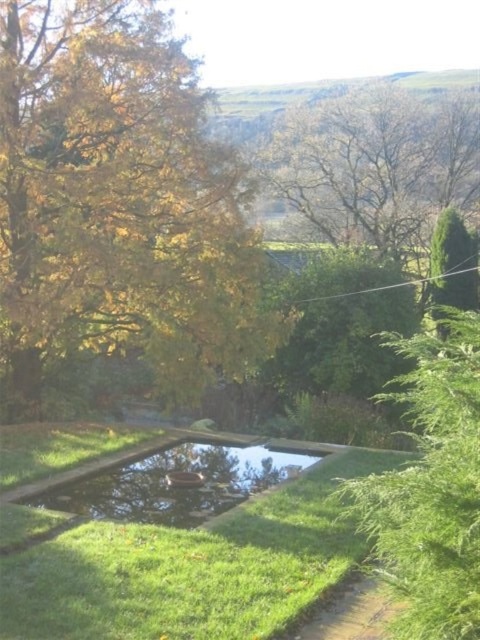
Does green grass at center have a greater width compared to clear glass pond at center?

Yes.

Is green grass at center below clear glass pond at center?

Indeed, green grass at center is positioned under clear glass pond at center.

The width and height of the screenshot is (480, 640). Describe the element at coordinates (192, 566) in the screenshot. I see `green grass at center` at that location.

You are a GUI agent. You are given a task and a screenshot of the screen. Output one action in this format:
    pyautogui.click(x=<x>, y=<y>)
    Task: Click on the green grass at center
    
    Given the screenshot: What is the action you would take?
    pyautogui.click(x=192, y=566)

In the scene shown: Does green leafy tree at right come behind green textured tree at right?

No.

Is point (479, 620) closer to viewer compared to point (472, 291)?

Yes, it is in front of point (472, 291).

The width and height of the screenshot is (480, 640). I want to click on green leafy tree at right, so click(x=431, y=484).

Does point (279, 138) come farther from viewer compared to point (445, 234)?

Yes, it is.

Between point (419, 196) and point (439, 243), which one is positioned behind?

Point (419, 196)

The height and width of the screenshot is (640, 480). I want to click on golden leafy tree at upper center, so click(x=376, y=164).